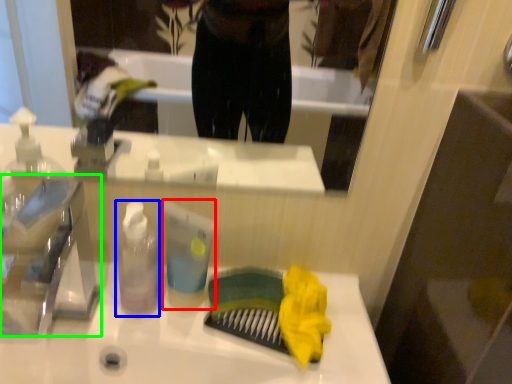
Question: Which object is positioned farthest from toiletry (highlighted by a red box)? Select from bottle (highlighted by a blue box) and faucet (highlighted by a green box).

Choices:
 (A) bottle
 (B) faucet

Answer: (B)